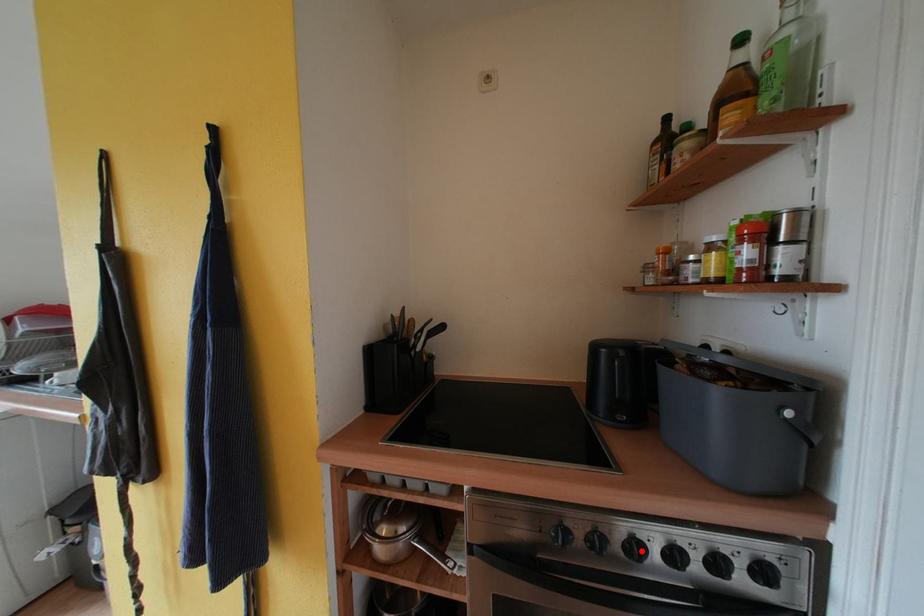
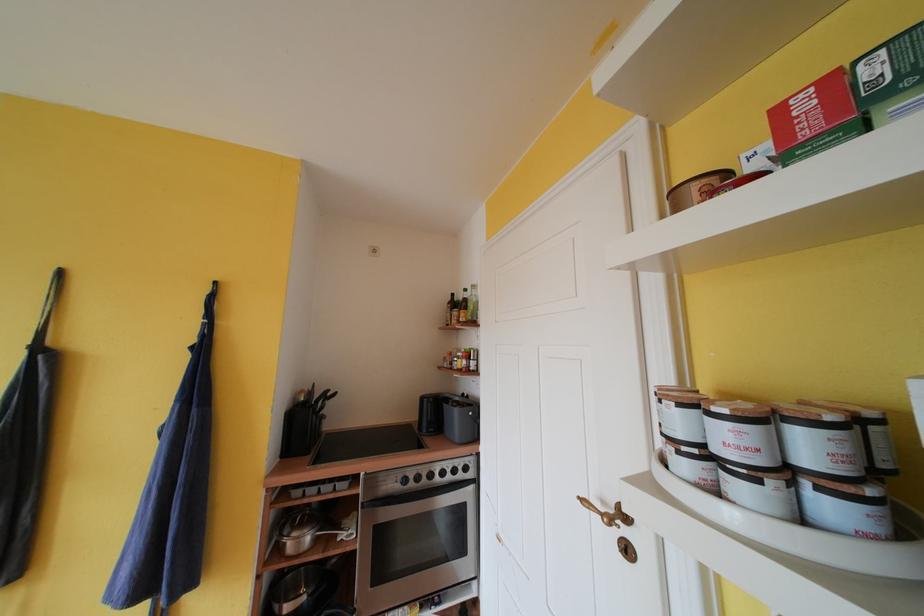
Find the pixel in the second image that matches the highlighted location in the first image.

(436, 479)